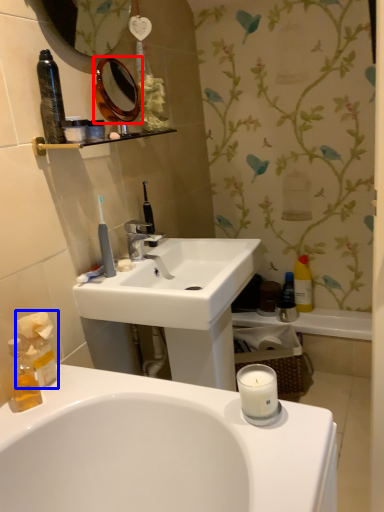
Question: Which object appears closest to the camera in this image, mirror (highlighted by a red box) or tissue (highlighted by a blue box)?

Choices:
 (A) mirror
 (B) tissue

Answer: (B)